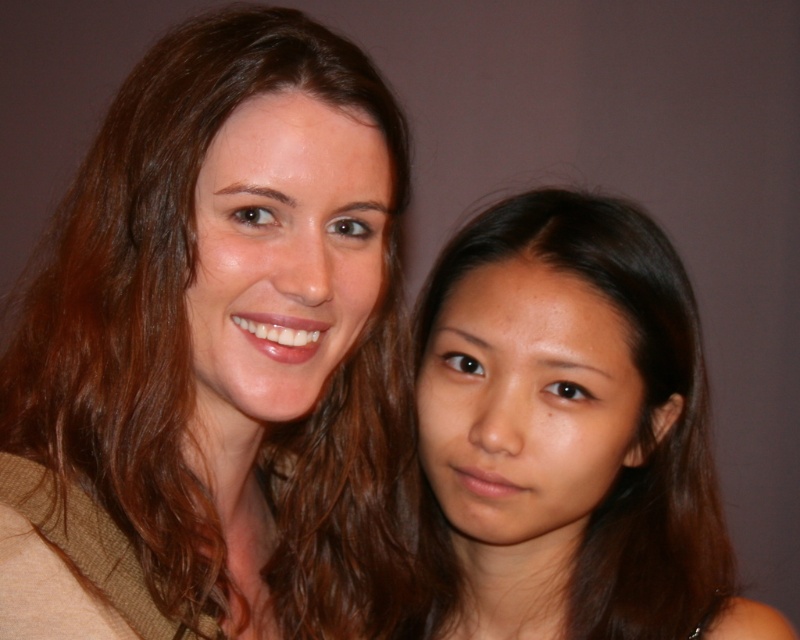
You are a photographer trying to adjust the lighting for a portrait. You need to ensure that the brown hair at center is evenly lit. Based on the scene description, where should you place the light source to achieve this?

To evenly light the brown hair at center located at point (214,353), position the light source directly in front of it, aligned with the camera to avoid harsh shadows and ensure even illumination.